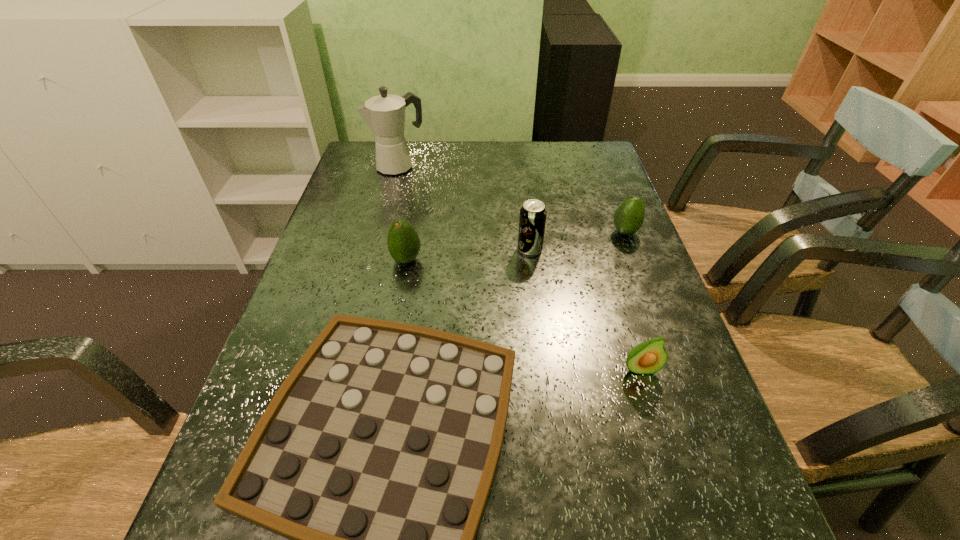
Locate an element on the screen. The image size is (960, 540). the tallest object is located at coordinates (385, 114).

This screenshot has width=960, height=540. In order to click on the farthest object in this screenshot , I will do `click(385, 114)`.

Where is `soda can`? This screenshot has width=960, height=540. soda can is located at coordinates (532, 220).

Identify the location of the leftmost avocado. The image size is (960, 540). (403, 242).

The width and height of the screenshot is (960, 540). I want to click on the farthest avocado, so click(628, 218).

Where is `the nearest avocado`? The image size is (960, 540). the nearest avocado is located at coordinates (648, 357).

This screenshot has width=960, height=540. In order to click on free space located on the front of the farthest object in this screenshot , I will do `click(388, 204)`.

Where is `free space located on the right of the fourth object from left to right`? This screenshot has width=960, height=540. free space located on the right of the fourth object from left to right is located at coordinates (562, 249).

You are a GUI agent. You are given a task and a screenshot of the screen. Output one action in this format:
    pyautogui.click(x=<x>, y=<y>)
    Task: Click on the vacant region located 0.390m on the front of the second farthest avocado
    The height and width of the screenshot is (540, 960).
    Given the screenshot: What is the action you would take?
    pyautogui.click(x=377, y=421)

What are the coordinates of `free location located on the left of the farthest avocado` in the screenshot? It's located at (516, 232).